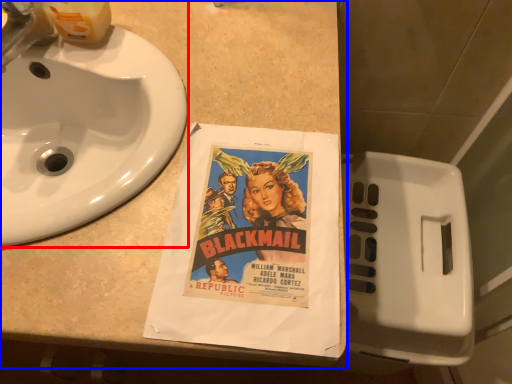
Question: Among these objects, which one is nearest to the camera, sink (highlighted by a red box) or counter top (highlighted by a blue box)?

Choices:
 (A) sink
 (B) counter top

Answer: (B)